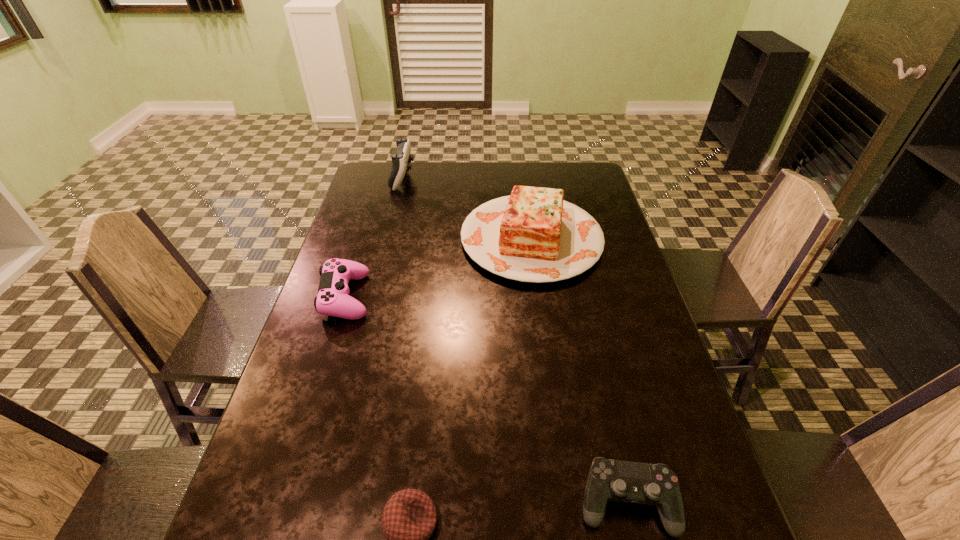
Identify the location of blank space at the far edge of the desktop. (509, 177).

You are a GUI agent. You are given a task and a screenshot of the screen. Output one action in this format:
    pyautogui.click(x=<x>, y=<y>)
    Task: Click on the vacant space at the left edge of the desktop
    
    Given the screenshot: What is the action you would take?
    pyautogui.click(x=316, y=363)

I want to click on free space at the right edge of the desktop, so 613,244.

The height and width of the screenshot is (540, 960). I want to click on vacant space at the far left corner, so click(x=374, y=163).

This screenshot has height=540, width=960. In the image, there is a desktop. Find the location of `vacant space at the far right corner`. vacant space at the far right corner is located at coordinates (598, 180).

The width and height of the screenshot is (960, 540). In order to click on free spot between the farthest object and the lasagna in this screenshot , I will do click(468, 208).

Identify the location of unoccupied position between the lasagna and the farthest object. (468, 208).

This screenshot has width=960, height=540. In order to click on vacant region between the second nearest control and the lasagna in this screenshot , I will do `click(439, 268)`.

Identify the location of vacant space in between the second nearest control and the farthest control. The width and height of the screenshot is (960, 540). (374, 237).

Locate an element on the screen. The image size is (960, 540). empty location between the lasagna and the farthest object is located at coordinates (468, 208).